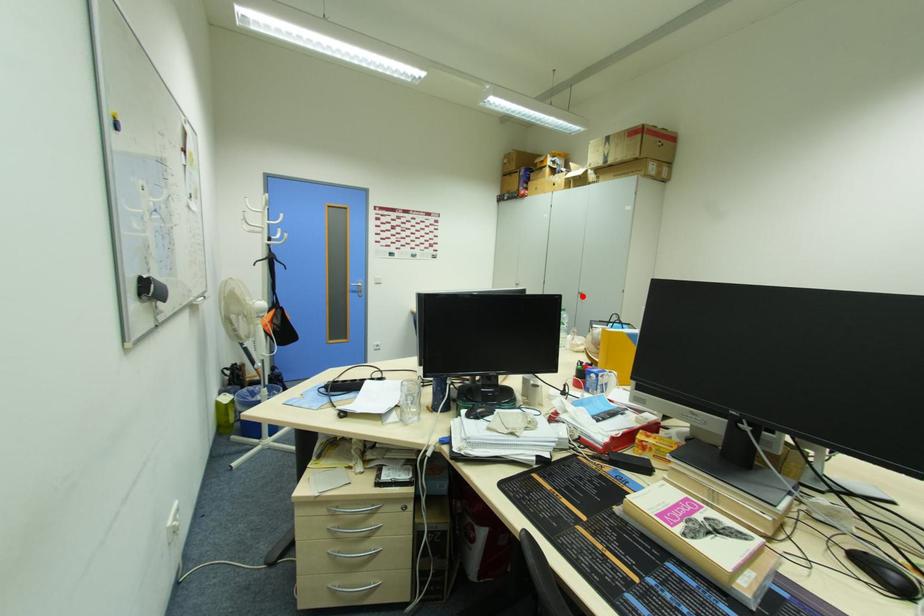
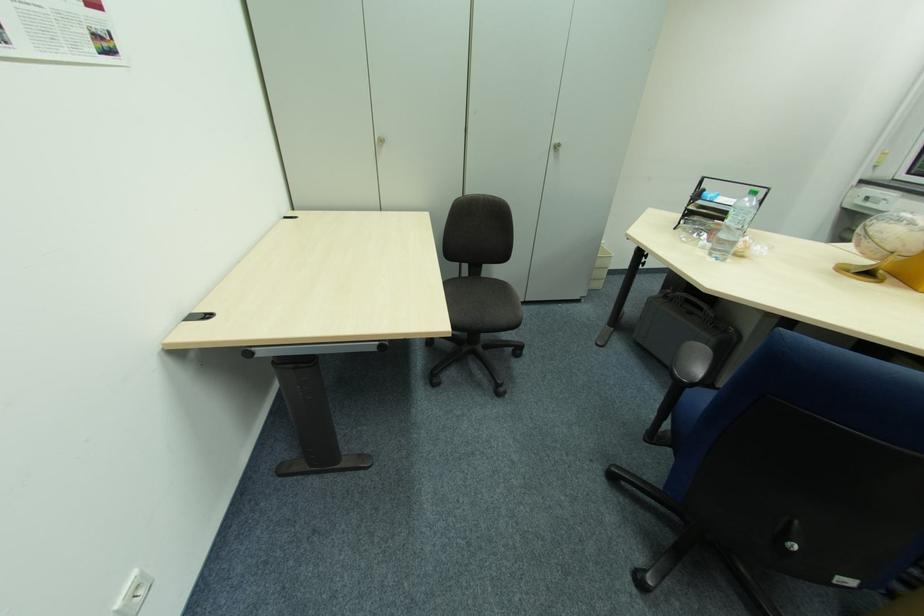
Question: I am providing you with two images of the same scene from different viewpoints. In image1, a red point is highlighted. Considering the same 3D point in image2, which of the following is correct?

Choices:
 (A) It is closer
 (B) It is farther

Answer: (A)